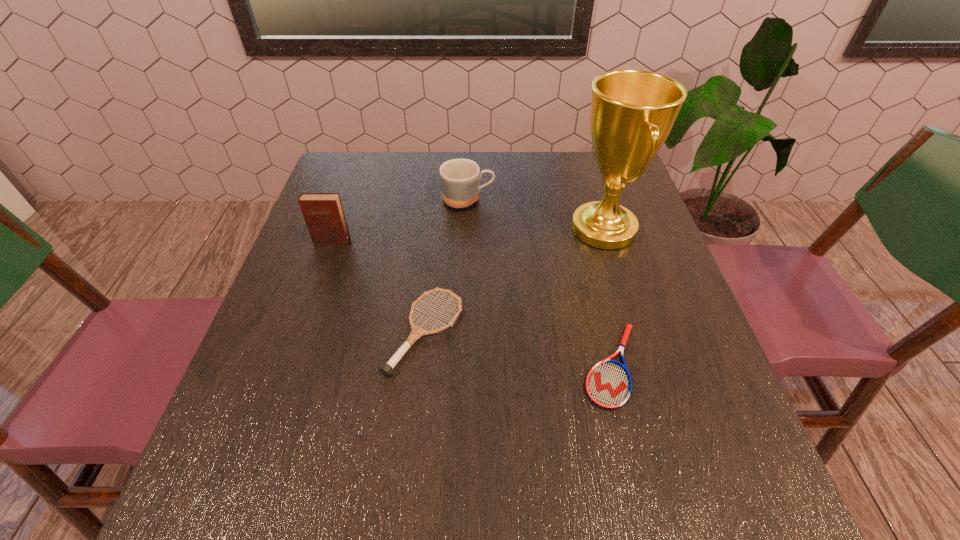
Identify the location of free space that satisfies the following two spatial constraints: 1. by the handles of the award; 2. on the front side of the left tennis racket. (635, 332).

In order to click on vacant region that satisfies the following two spatial constraints: 1. on the back side of the right tennis racket; 2. on the side with the handle of the third tallest object in this screenshot , I will do `click(571, 200)`.

At what (x,y) coordinates should I click in order to perform the action: click on vacant space that satisfies the following two spatial constraints: 1. on the front cover of the shorter tennis racket; 2. on the left side of the leftmost object. Please return your answer as a coordinate pair (x, y). Looking at the image, I should click on (288, 366).

Find the location of a particular element. The width and height of the screenshot is (960, 540). free location that satisfies the following two spatial constraints: 1. by the handles of the tallest object; 2. on the front cover of the diary is located at coordinates (608, 242).

Where is `free space that satisfies the following two spatial constraints: 1. by the handles of the award; 2. on the front cover of the diary`? This screenshot has height=540, width=960. free space that satisfies the following two spatial constraints: 1. by the handles of the award; 2. on the front cover of the diary is located at coordinates (608, 242).

Where is `vacant area that satisfies the following two spatial constraints: 1. on the side with the handle of the shorter tennis racket; 2. on the right side of the mug`? vacant area that satisfies the following two spatial constraints: 1. on the side with the handle of the shorter tennis racket; 2. on the right side of the mug is located at coordinates (463, 366).